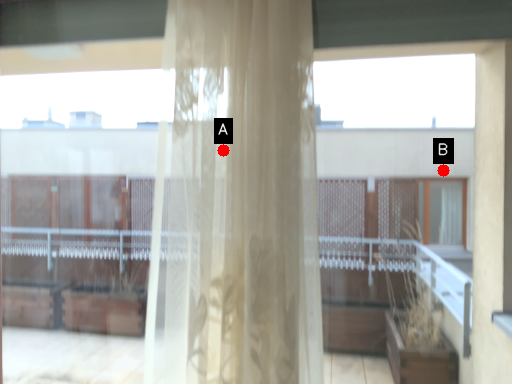
Question: Two points are circled on the image, labeled by A and B beside each circle. Among these points, which one is farthest from the camera?

Choices:
 (A) A is further
 (B) B is further

Answer: (B)